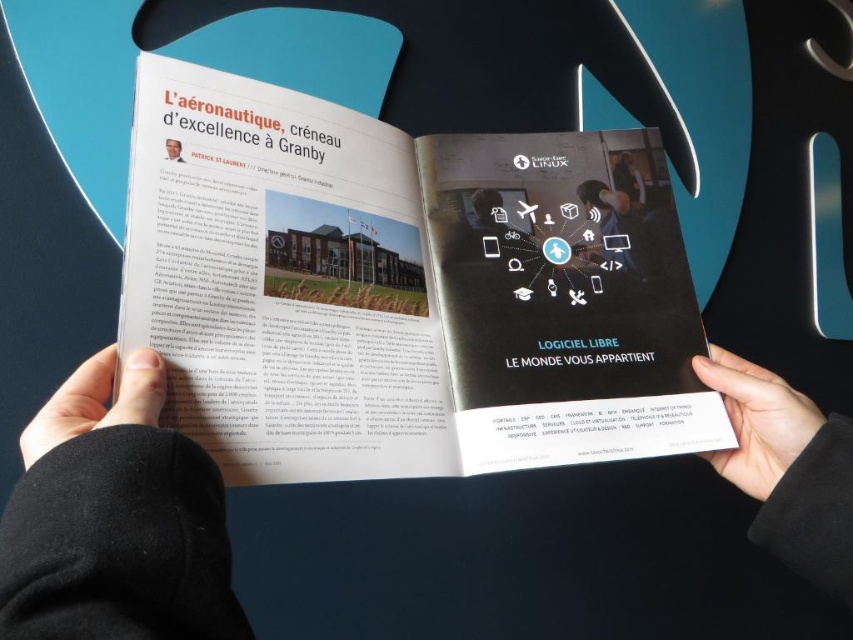
You are a photographer trying to focus on two points in the magazine image. The first point is at coordinates point (450, 220) and the second is at point (762, 468). Which point should you adjust your focus to first if you want to capture both clearly?

You should focus on point (450, 220) first because it is closer to the camera than point (762, 468). After focusing on the closer point, you can adjust the focus to the farther point to ensure both are clear.